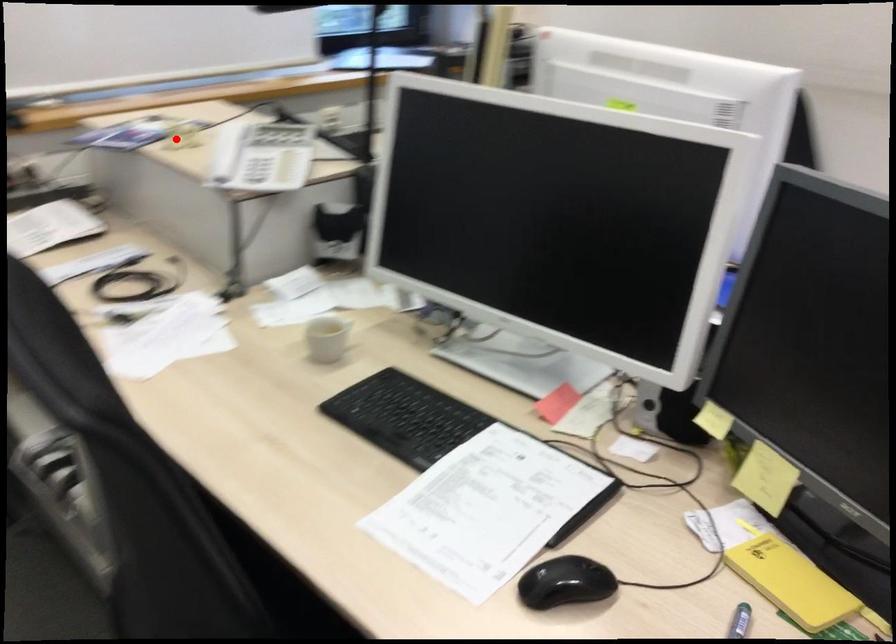
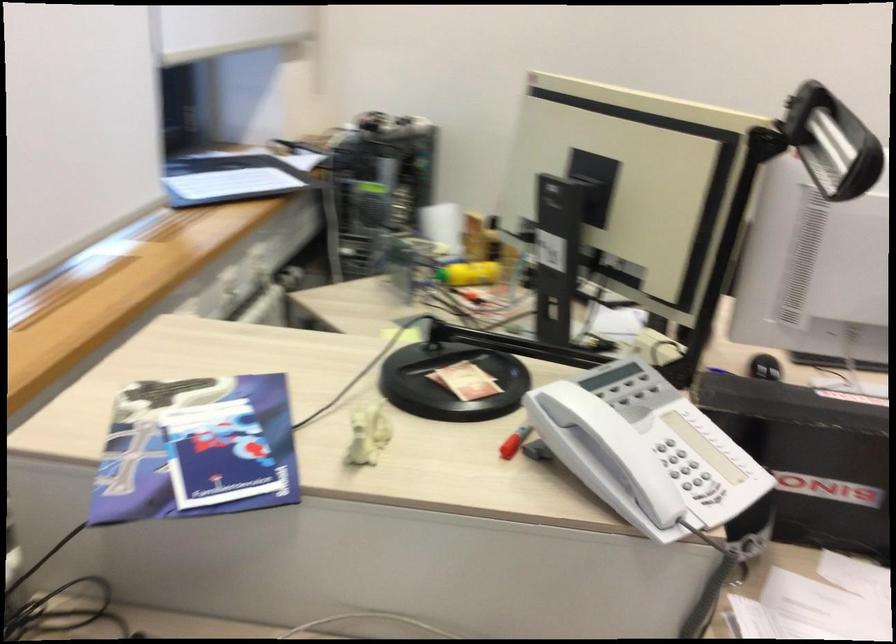
Locate, in the second image, the point that corresponds to the highlighted location in the first image.

(367, 433)